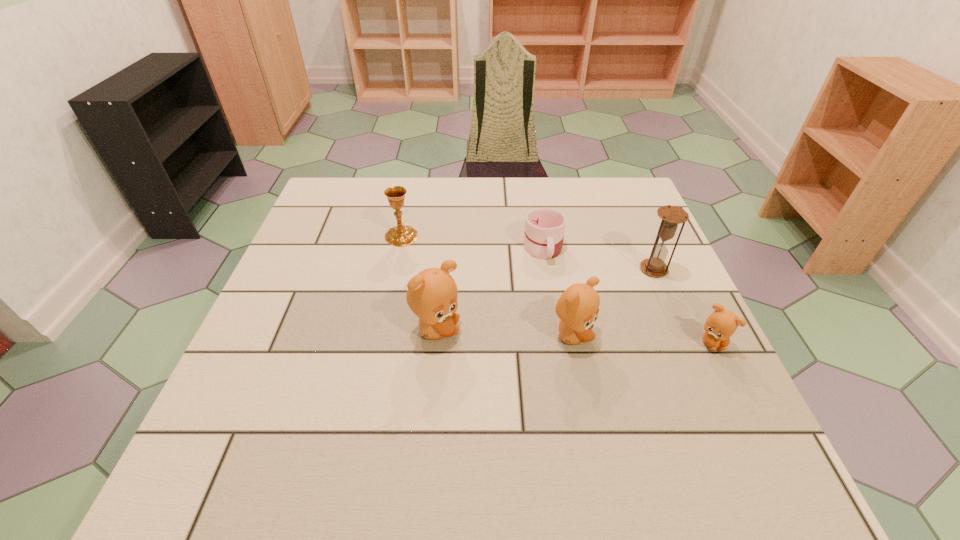
Where is `vacant space at the far right corner of the desktop`? This screenshot has width=960, height=540. vacant space at the far right corner of the desktop is located at coordinates (593, 179).

Where is `vacant space at the near right corner`? This screenshot has height=540, width=960. vacant space at the near right corner is located at coordinates (670, 393).

Locate an element on the screen. The image size is (960, 540). free space between the chalice and the fifth tallest object is located at coordinates (557, 289).

Locate an element on the screen. This screenshot has width=960, height=540. blank region between the hourglass and the shortest object is located at coordinates (598, 258).

Locate an element on the screen. Image resolution: width=960 pixels, height=540 pixels. free area in between the hourglass and the leftmost teddy bear is located at coordinates (544, 300).

At what (x,y) coordinates should I click in order to perform the action: click on vacant space that's between the rightmost teddy bear and the hourglass. Please return your answer as a coordinate pair (x, y). This screenshot has width=960, height=540. Looking at the image, I should click on tap(683, 306).

Where is `free space between the chalice and the shortest object`? The width and height of the screenshot is (960, 540). free space between the chalice and the shortest object is located at coordinates (472, 242).

Where is `free space that is in between the chalice and the second shortest teddy bear`? The height and width of the screenshot is (540, 960). free space that is in between the chalice and the second shortest teddy bear is located at coordinates (487, 286).

The image size is (960, 540). What are the coordinates of `object that ranks as the fifth closest to the hourglass` in the screenshot? It's located at (402, 235).

Image resolution: width=960 pixels, height=540 pixels. Find the location of `object that stands as the fifth closest to the leftmost object`. object that stands as the fifth closest to the leftmost object is located at coordinates (722, 323).